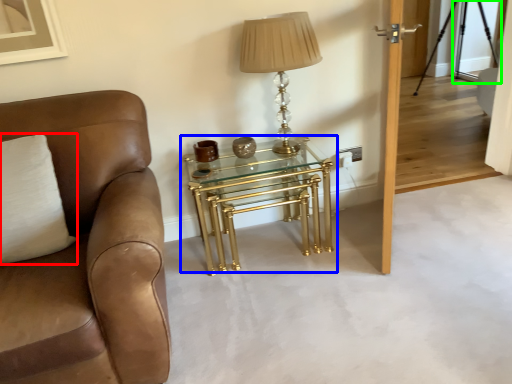
Question: Based on their relative distances, which object is nearer to pillow (highlighted by a red box)? Choose from table (highlighted by a blue box) and glass door (highlighted by a green box).

Choices:
 (A) table
 (B) glass door

Answer: (A)